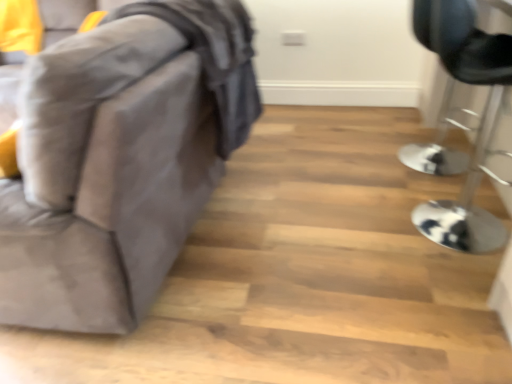
Where is `free location in front of metallic silver bar stool at right, which is counted as the second furniture, starting from the left`? free location in front of metallic silver bar stool at right, which is counted as the second furniture, starting from the left is located at coordinates (445, 292).